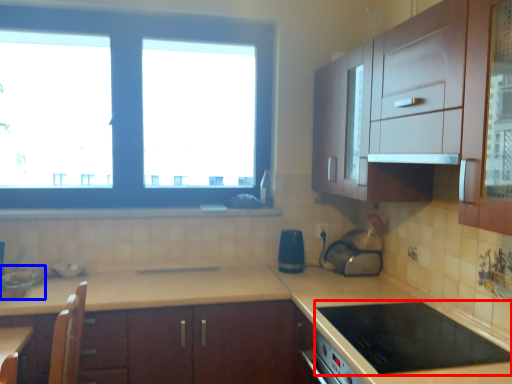
Question: Which object appears closest to the camera in this image, gas stove (highlighted by a red box) or appliance (highlighted by a blue box)?

Choices:
 (A) gas stove
 (B) appliance

Answer: (A)